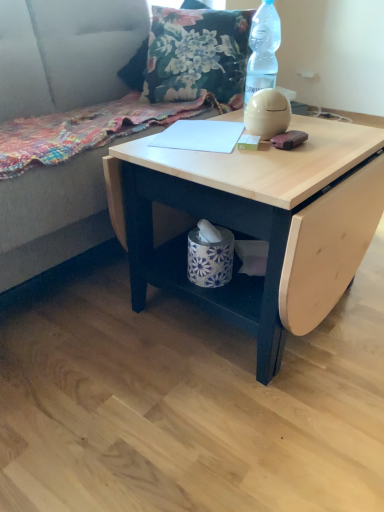
Where is `space that is in front of white paper at center`? space that is in front of white paper at center is located at coordinates 216,162.